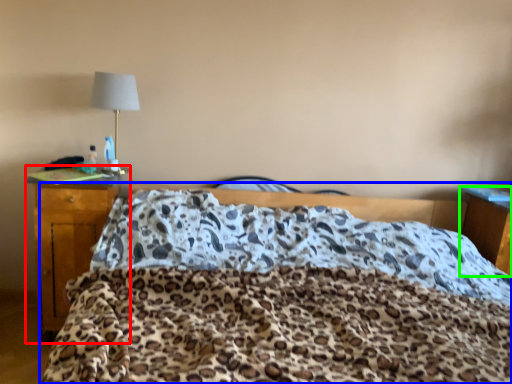
Question: Which object is the closest to the desk (highlighted by a red box)? Choose among these: bed (highlighted by a blue box) or nightstand (highlighted by a green box).

Choices:
 (A) bed
 (B) nightstand

Answer: (A)